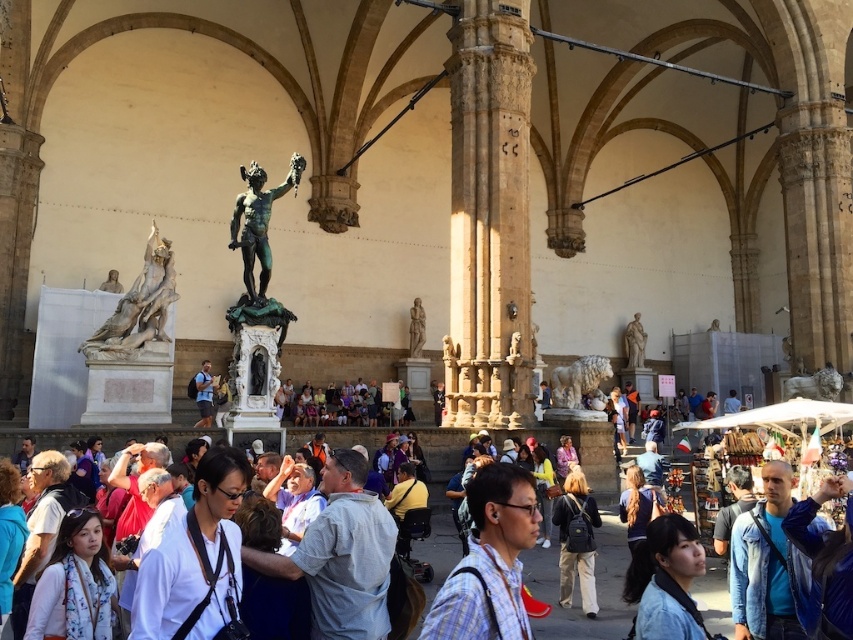
Question: Considering the relative positions of white marble statue at left and polished marble statue at center in the image provided, where is white marble statue at left located with respect to polished marble statue at center?

Choices:
 (A) below
 (B) above

Answer: (B)

Question: Which point is farther from the camera taking this photo?

Choices:
 (A) (660, 541)
 (B) (575, 452)
 (C) (654, 502)

Answer: (B)

Question: Is beige stone column at center positioned at the back of khaki pants at center?

Choices:
 (A) yes
 (B) no

Answer: (A)

Question: Which point appears farthest from the camera in this image?

Choices:
 (A) (103, 346)
 (B) (624, 348)
 (C) (195, 426)

Answer: (B)

Question: Based on their relative distances, which object is nearer to the polished marble statue at center?

Choices:
 (A) beige stone column at center
 (B) white scarf at lower left
 (C) khaki pants at center
 (D) blue leather jacket at lower right

Answer: (A)

Question: Does white marble statue at left appear on the right side of khaki pants at center?

Choices:
 (A) no
 (B) yes

Answer: (A)